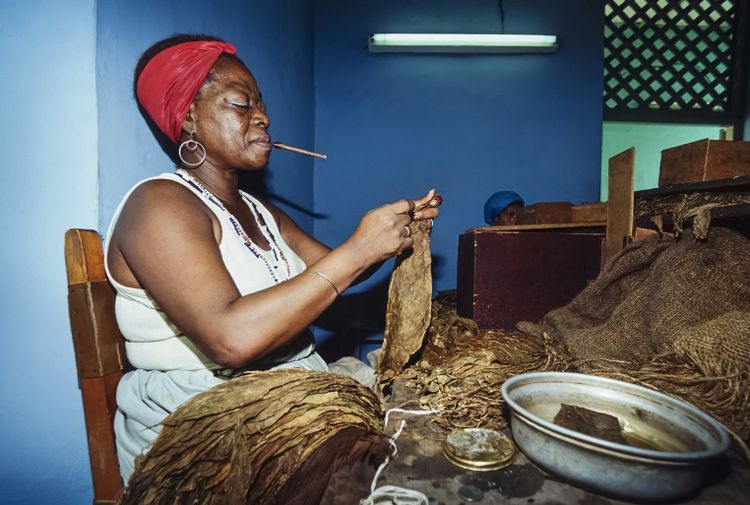
Image resolution: width=750 pixels, height=505 pixels. I want to click on wall behind  seated woman, so click(x=124, y=162).